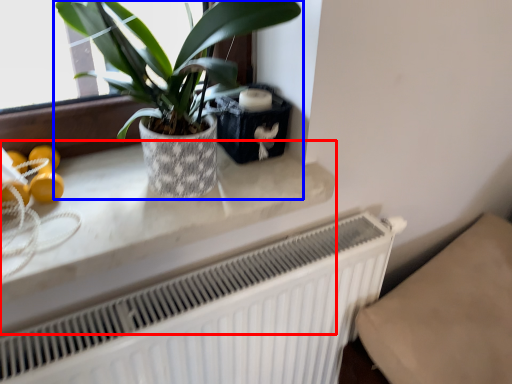
Question: Among these objects, which one is nearest to the camera, counter top (highlighted by a red box) or houseplant (highlighted by a blue box)?

Choices:
 (A) counter top
 (B) houseplant

Answer: (B)